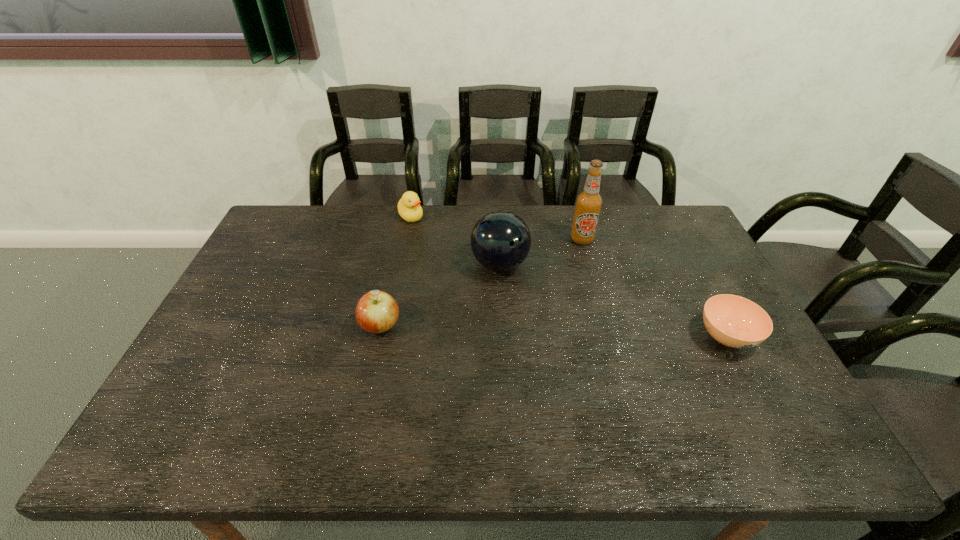
Locate an element on the screen. The width and height of the screenshot is (960, 540). free spot on the desktop that is between the apple and the soup bowl and is positioned on the front label of the tallest object is located at coordinates click(x=576, y=332).

At what (x,y) coordinates should I click in order to perform the action: click on free space on the desktop that is between the apple and the shortest object and is positioned on the side of the third object from left to right with the finger holes. Please return your answer as a coordinate pair (x, y). Looking at the image, I should click on (601, 333).

Locate an element on the screen. free space on the desktop that is between the apple and the rightmost object and is positioned on the face of the farthest object is located at coordinates (510, 330).